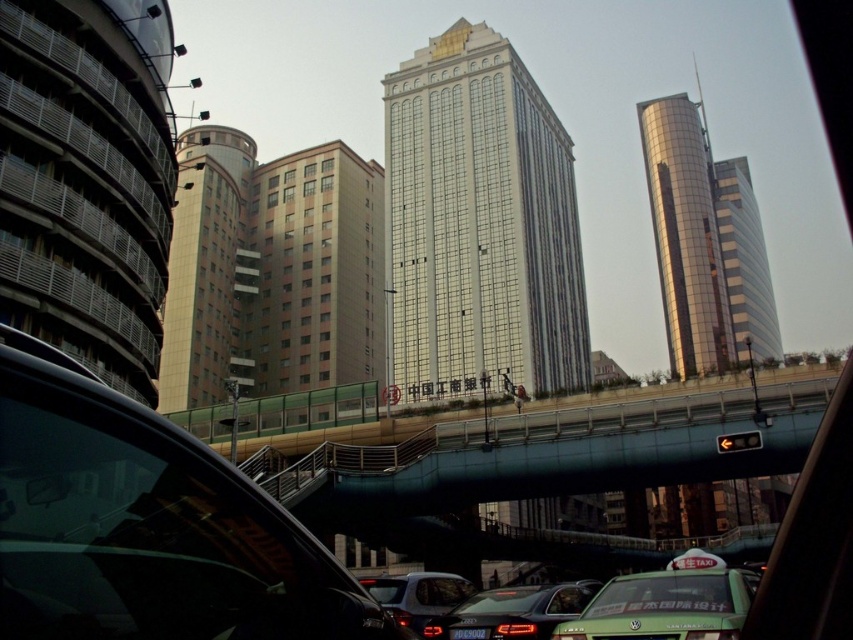
Question: Which is farther from the matte gray sedan at lower center?

Choices:
 (A) glossy glass tower at upper right
 (B) green metallic bridge at center

Answer: (A)

Question: Does beige textured building at center appear over green matte taxi at lower right?

Choices:
 (A) yes
 (B) no

Answer: (A)

Question: Which object is positioned closest to the beige textured building at center?

Choices:
 (A) glossy glass tower at upper right
 (B) white glass building at center
 (C) green matte taxi at lower right
 (D) green metallic bridge at center

Answer: (B)

Question: Does shiny black car at lower left come in front of glossy glass tower at upper right?

Choices:
 (A) no
 (B) yes

Answer: (B)

Question: Which is farther from the beige textured building at center?

Choices:
 (A) gold reflective glass tower at right
 (B) shiny black car at lower left
 (C) white glass building at center
 (D) matte black car at center

Answer: (B)

Question: Is glossy glass tower at upper right in front of matte black car at center?

Choices:
 (A) yes
 (B) no

Answer: (B)